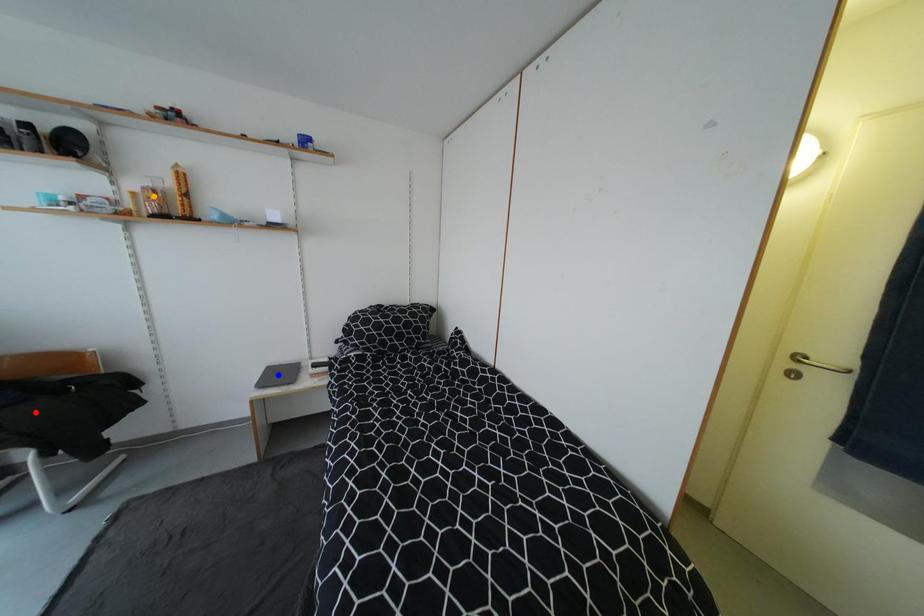
Order these from nearest to farthest:
orange point | red point | blue point

1. red point
2. orange point
3. blue point